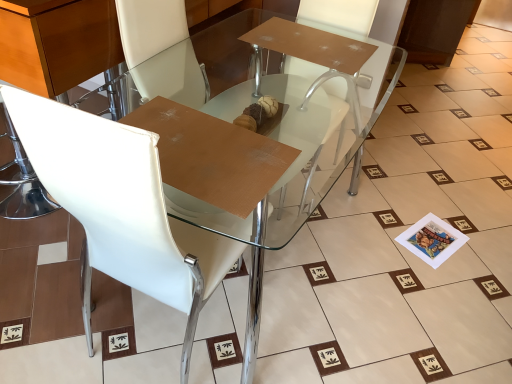
This screenshot has height=384, width=512. Find the location of `vacant area that is situated to the right of transparent glass table at center`. vacant area that is situated to the right of transparent glass table at center is located at coordinates (411, 268).